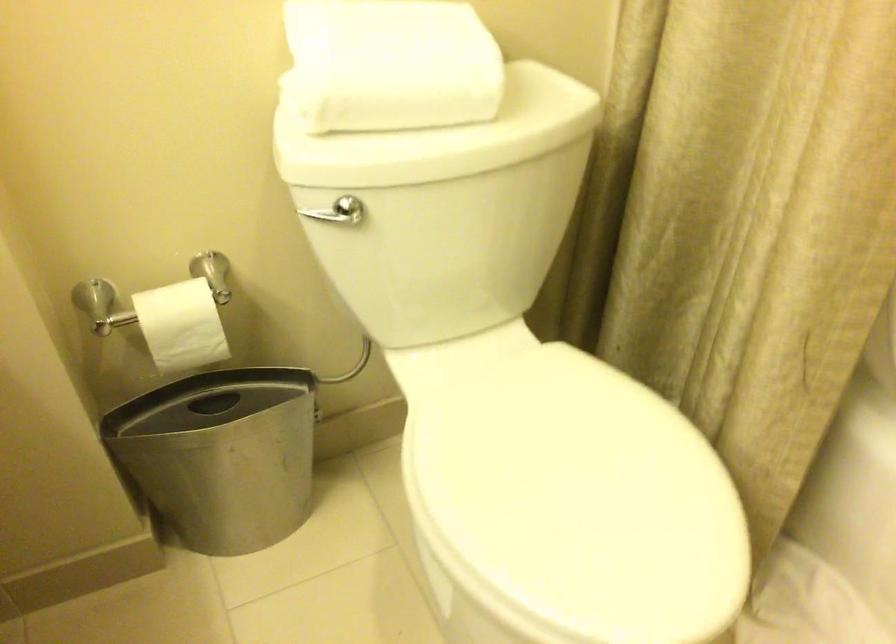
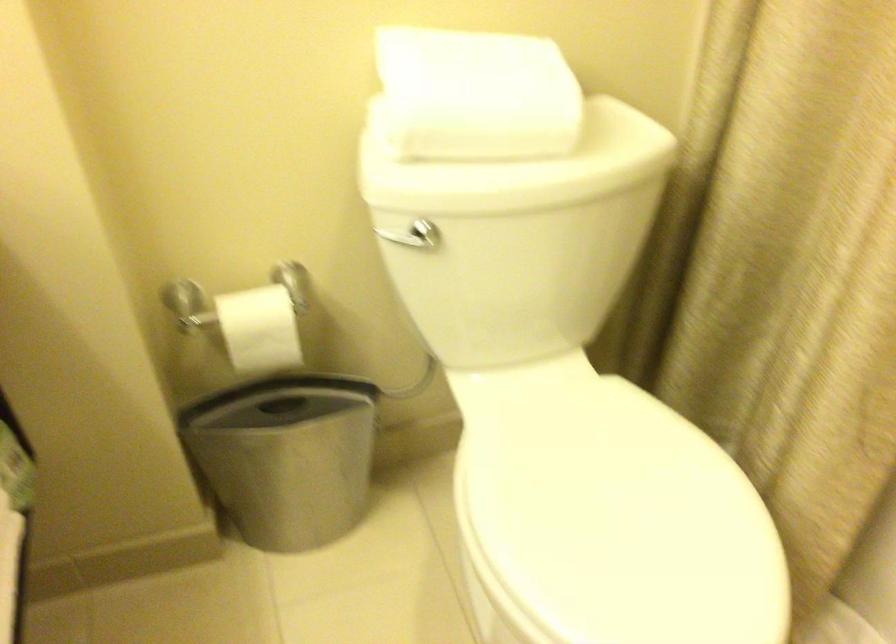
In the second image, find the point that corresponds to point (444, 134) in the first image.

(519, 167)